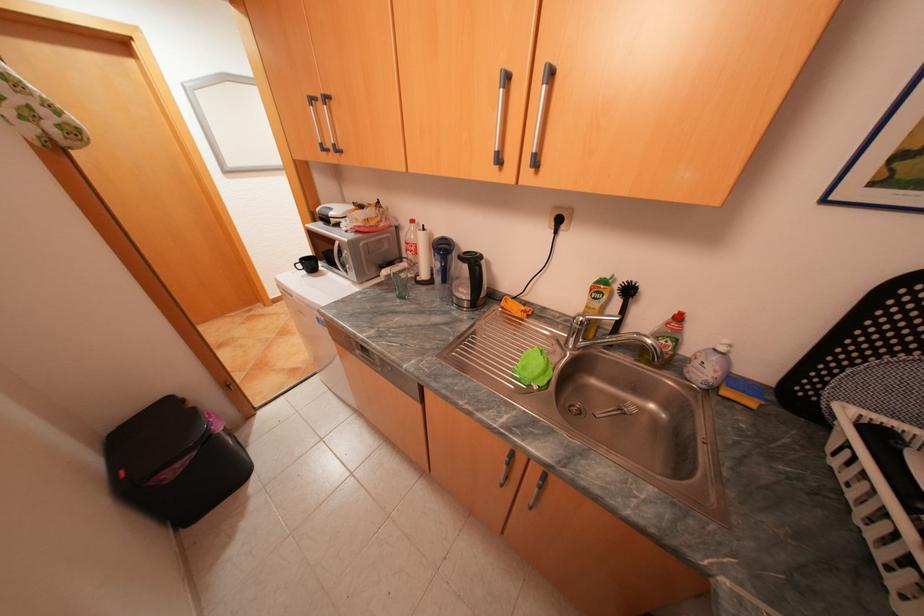
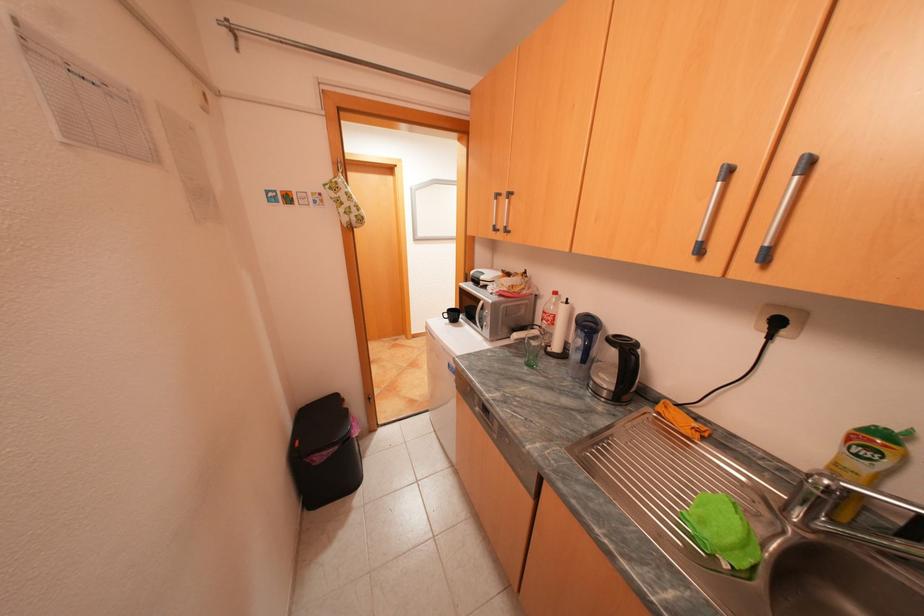
Find the pixel in the second image that matches (x=545, y=387) in the first image.

(736, 565)